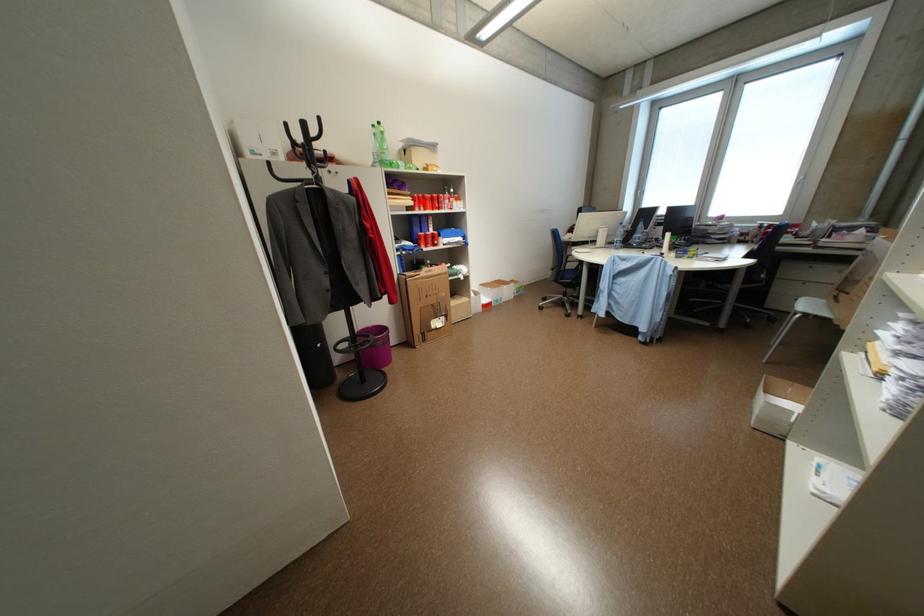
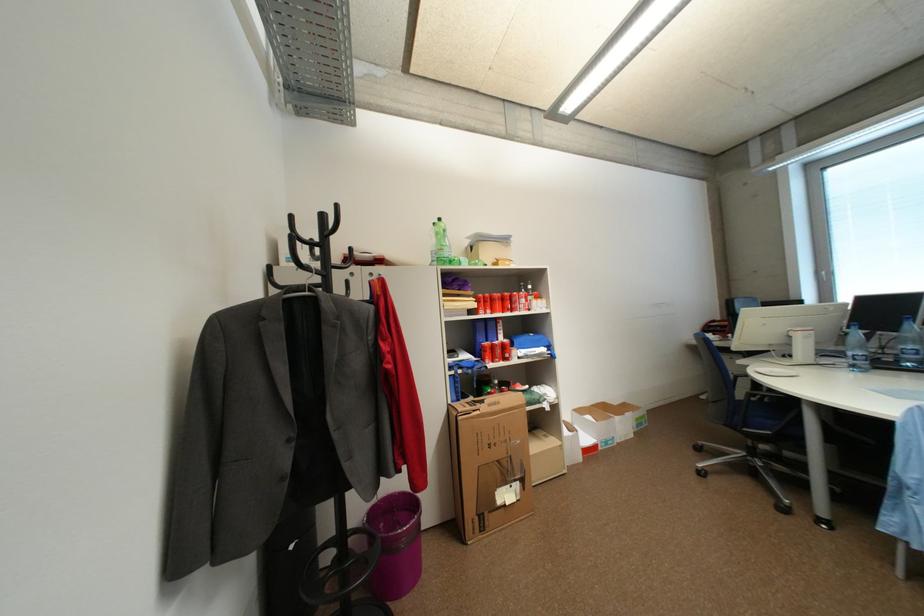
Question: A red point is marked in image1. In image2, is the corresponding 3D point closer to the camera or farther? Reply with the corresponding letter.

Choices:
 (A) The corresponding 3D point is closer.
 (B) The corresponding 3D point is farther.

Answer: (B)